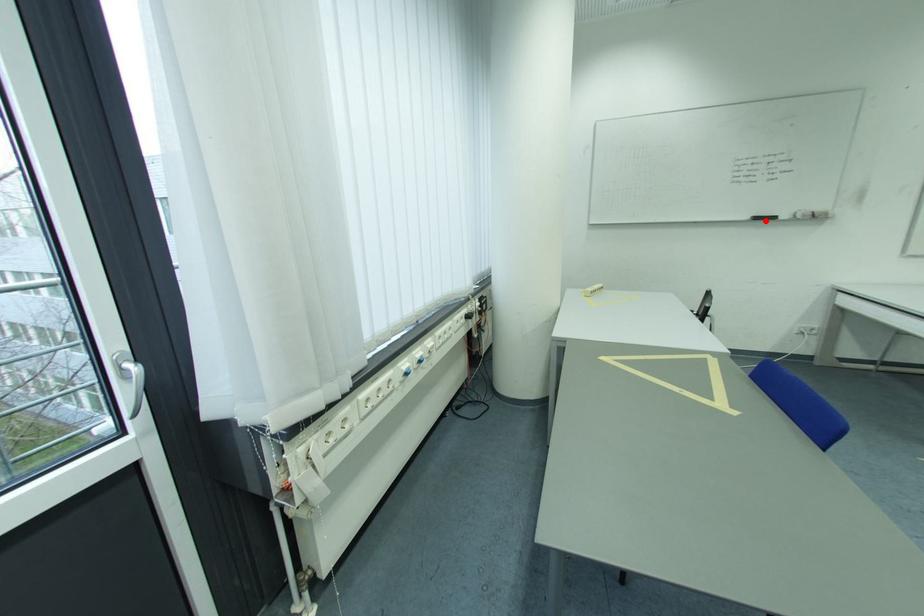
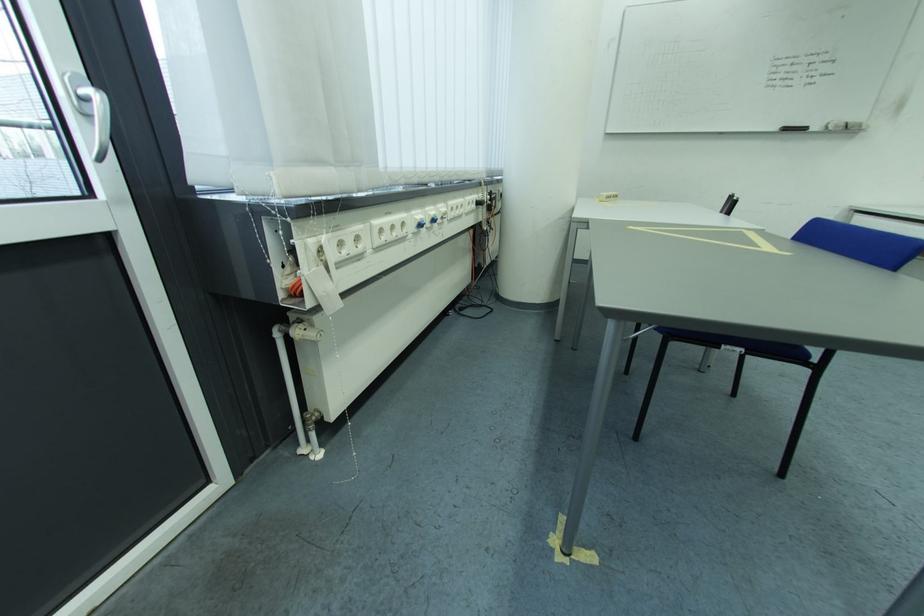
Locate, in the second image, the point that corresponds to the highlighted location in the first image.

(796, 131)